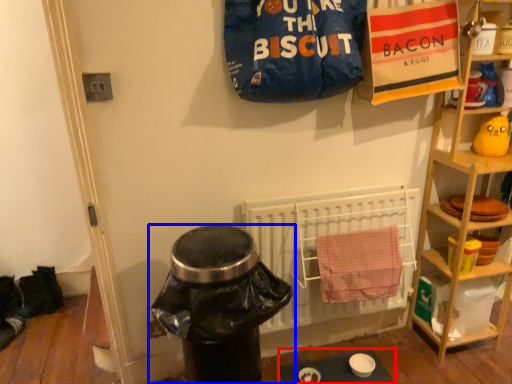
Question: Which of the following is the farthest to the observer, table (highlighted by a red box) or trash bin/can (highlighted by a blue box)?

Choices:
 (A) table
 (B) trash bin/can

Answer: (A)